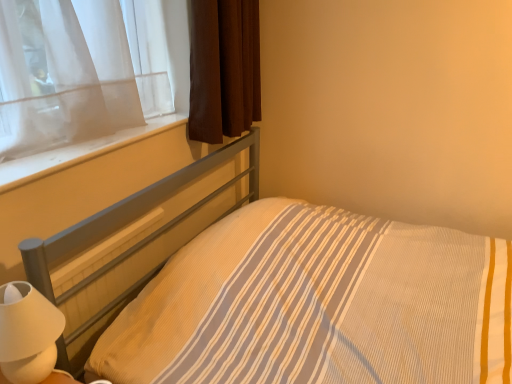
Question: In terms of size, does yellow striped fabric at center appear bigger or smaller than white smooth window sill at upper left?

Choices:
 (A) small
 (B) big

Answer: (B)

Question: In terms of height, does yellow striped fabric at center look taller or shorter compared to white smooth window sill at upper left?

Choices:
 (A) short
 (B) tall

Answer: (B)

Question: Considering the real-world distances, which object is closest to the yellow striped fabric at center?

Choices:
 (A) white smooth window sill at upper left
 (B) brown fabric curtain at upper left
 (C) white matte table lamp at lower left

Answer: (A)

Question: Which object is the closest to the white matte table lamp at lower left?

Choices:
 (A) yellow striped fabric at center
 (B) white smooth window sill at upper left
 (C) brown fabric curtain at upper left

Answer: (A)